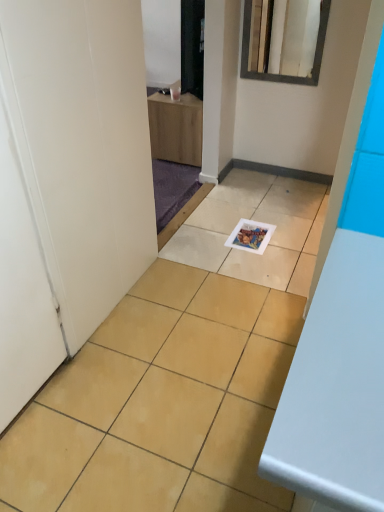
Describe the element at coordinates (22, 278) in the screenshot. I see `white matte door at left` at that location.

Locate an element on the screen. This screenshot has height=512, width=384. white matte door at left is located at coordinates (22, 278).

Is white glossy mirror at upper center further to camera compared to matte paper magazine at center?

Yes, white glossy mirror at upper center is further from the camera.

Between white glossy mirror at upper center and matte paper magazine at center, which one appears on the right side from the viewer's perspective?

Positioned to the right is white glossy mirror at upper center.

Could you tell me if white glossy mirror at upper center is facing matte paper magazine at center?

No, white glossy mirror at upper center is not oriented towards matte paper magazine at center.

Is white glossy mirror at upper center beside matte paper magazine at center?

white glossy mirror at upper center is not next to matte paper magazine at center, and they're not touching.

From the image's perspective, which object appears higher, matte paper magazine at center or white matte door at left?

matte paper magazine at center is shown above in the image.

Measure the distance between matte paper magazine at center and white matte door at left.

matte paper magazine at center and white matte door at left are 1.19 meters apart from each other.

Find the location of a particular element. The image size is (384, 512). door above the matte paper magazine at center (from a real-world perspective) is located at coordinates (22, 278).

Does matte paper magazine at center have a larger size compared to white matte door at left?

No, matte paper magazine at center is not bigger than white matte door at left.

Considering the positions of point (285, 76) and point (21, 170), is point (285, 76) closer or farther from the camera than point (21, 170)?

Point (285, 76) is positioned farther from the camera compared to point (21, 170).

Is white glossy mirror at upper center looking in the opposite direction of white matte door at left?

That's not correct — white glossy mirror at upper center is not looking away from white matte door at left.

From a real-world perspective, is white glossy mirror at upper center beneath white matte door at left?

No.

Where is `mirror on the right of white matte door at left`? The height and width of the screenshot is (512, 384). mirror on the right of white matte door at left is located at coordinates (279, 74).

Which of these two, white matte door at left or white glossy mirror at upper center, is thinner?

white glossy mirror at upper center is thinner.

From the image's perspective, which object appears higher, white matte door at left or white glossy mirror at upper center?

white glossy mirror at upper center is shown above in the image.

Who is shorter, white matte door at left or white glossy mirror at upper center?

white glossy mirror at upper center.

From a real-world perspective, is white matte door at left below white glossy mirror at upper center?

Yes.

From the image's perspective, is white matte door at left located beneath matte paper magazine at center?

Yes, from the image's perspective, white matte door at left is below matte paper magazine at center.

Can you confirm if white matte door at left is wider than matte paper magazine at center?

No.

Based on the photo, considering the relative sizes of white matte door at left and matte paper magazine at center in the image provided, is white matte door at left taller than matte paper magazine at center?

Yes, white matte door at left is taller than matte paper magazine at center.

Considering the positions of point (14, 377) and point (244, 248), is point (14, 377) closer or farther from the camera than point (244, 248)?

Clearly, point (14, 377) is closer to the camera than point (244, 248).

The width and height of the screenshot is (384, 512). Identify the location of mirror positioned vertically above the matte paper magazine at center (from a real-world perspective). (279, 74).

How much distance is there between matte paper magazine at center and white glossy mirror at upper center?

The distance of matte paper magazine at center from white glossy mirror at upper center is 38.68 inches.

From a real-world perspective, does matte paper magazine at center stand above white glossy mirror at upper center?

No.

At what (x,y) coordinates should I click in order to perform the action: click on magazine in front of the white glossy mirror at upper center. Please return your answer as a coordinate pair (x, y). The width and height of the screenshot is (384, 512). Looking at the image, I should click on (251, 236).

I want to click on magazine on the right of white matte door at left, so click(x=251, y=236).

When comparing their distances from white glossy mirror at upper center, does matte paper magazine at center or white matte door at left seem further?

white matte door at left is further to white glossy mirror at upper center.

Estimate the real-world distances between objects in this image. Which object is further from white matte door at left, matte paper magazine at center or white glossy mirror at upper center?

white glossy mirror at upper center is positioned further to the anchor white matte door at left.

Which object lies nearer to the anchor point white glossy mirror at upper center, white matte door at left or matte paper magazine at center?

matte paper magazine at center is positioned closer to the anchor white glossy mirror at upper center.

Looking at the image, which one is located further to matte paper magazine at center, white matte door at left or white glossy mirror at upper center?

white matte door at left.

Estimate the real-world distances between objects in this image. Which object is closer to white matte door at left, white glossy mirror at upper center or matte paper magazine at center?

matte paper magazine at center.

Estimate the real-world distances between objects in this image. Which object is further from matte paper magazine at center, white glossy mirror at upper center or white matte door at left?

white matte door at left is further to matte paper magazine at center.

Where is `magazine between white matte door at left and white glossy mirror at upper center from front to back`? magazine between white matte door at left and white glossy mirror at upper center from front to back is located at coordinates (251, 236).